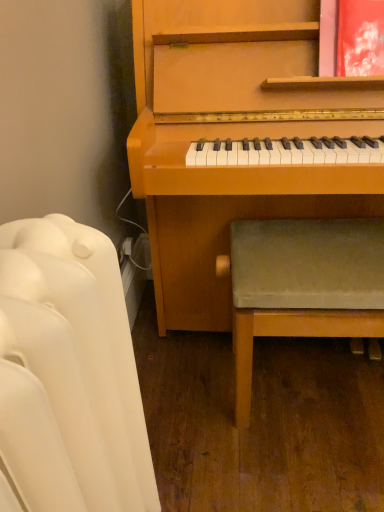
At what (x,y) coordinates should I click in order to perform the action: click on free point above green fabric stool at lower right (from a real-world perspective). Please return your answer as a coordinate pair (x, y). This screenshot has height=512, width=384. Looking at the image, I should click on coord(319,242).